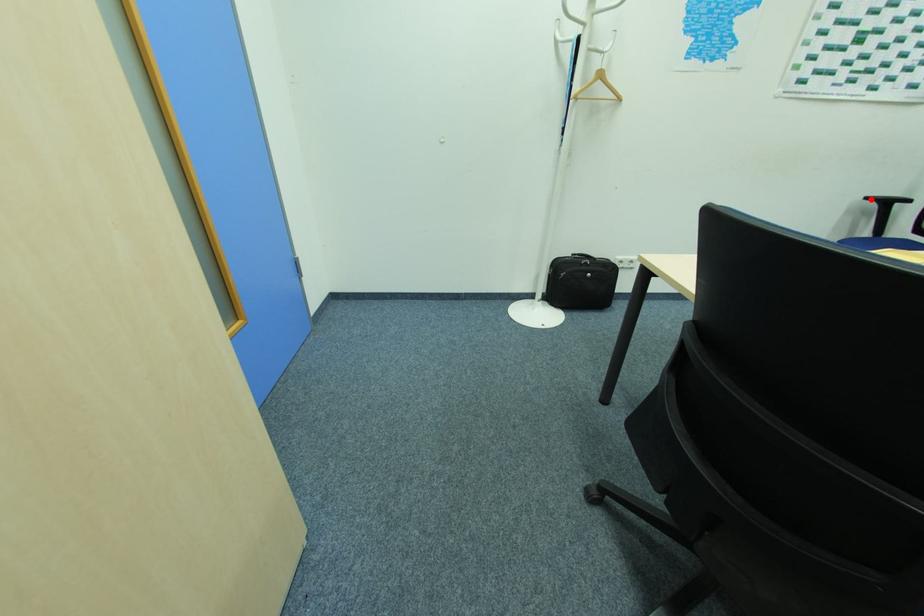
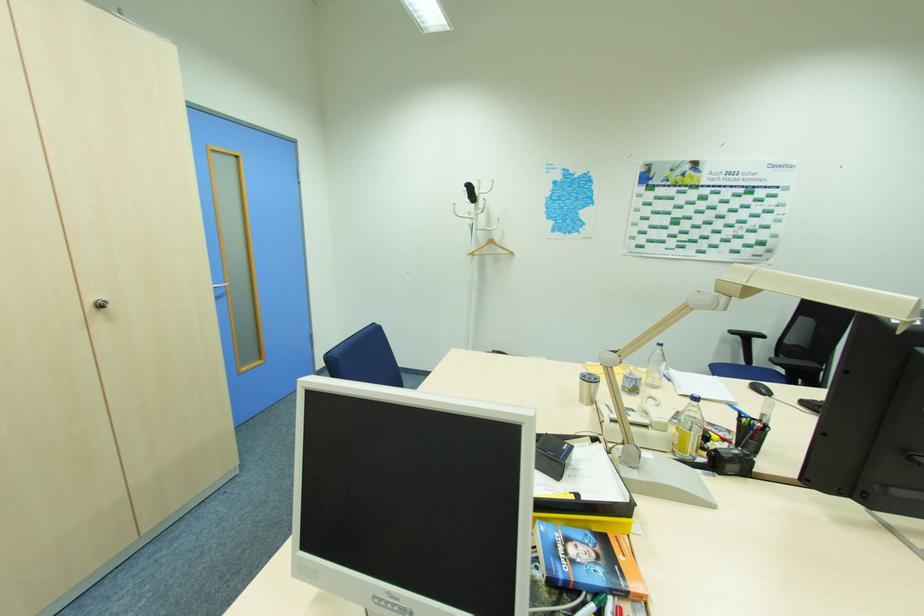
Locate, in the second image, the point that corresponds to the highlighted location in the first image.

(734, 331)